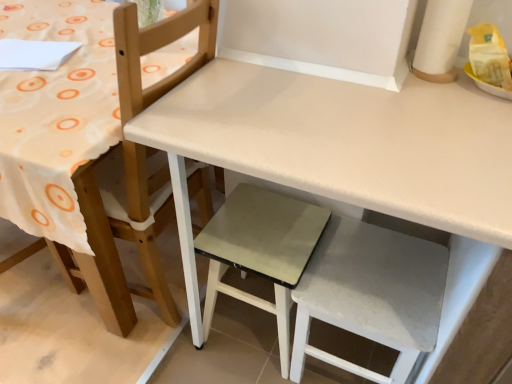
Question: Is matte gray step stool at center, acting as the second step stool starting from the right, with white matte table at center?

Choices:
 (A) no
 (B) yes

Answer: (A)

Question: Can white matte table at center be found inside matte gray step stool at center, acting as the second step stool starting from the right?

Choices:
 (A) yes
 (B) no

Answer: (B)

Question: Is matte gray step stool at center, acting as the second step stool starting from the right, looking in the opposite direction of white matte table at center?

Choices:
 (A) yes
 (B) no

Answer: (A)

Question: Is matte gray step stool at center, acting as the second step stool starting from the right, not close to white matte table at center?

Choices:
 (A) yes
 (B) no

Answer: (B)

Question: From the image's perspective, would you say matte gray step stool at center, acting as the second step stool starting from the right, is shown under white matte table at center?

Choices:
 (A) yes
 (B) no

Answer: (A)

Question: Does matte gray step stool at center, acting as the second step stool starting from the right, turn towards white matte table at center?

Choices:
 (A) no
 (B) yes

Answer: (B)

Question: Considering the relative positions of white fabric step stool at lower right, placed as the second step stool when sorted from left to right, and white matte table at center in the image provided, is white fabric step stool at lower right, placed as the second step stool when sorted from left to right, to the left of white matte table at center from the viewer's perspective?

Choices:
 (A) no
 (B) yes

Answer: (B)

Question: Is the position of white fabric step stool at lower right, placed as the second step stool when sorted from left to right, less distant than that of white matte table at center?

Choices:
 (A) no
 (B) yes

Answer: (A)

Question: From the image's perspective, is white fabric step stool at lower right, the 1th step stool from the right, beneath white matte table at center?

Choices:
 (A) yes
 (B) no

Answer: (A)

Question: Considering the relative positions of white fabric step stool at lower right, the 1th step stool from the right, and white matte table at center in the image provided, is white fabric step stool at lower right, the 1th step stool from the right, to the right of white matte table at center from the viewer's perspective?

Choices:
 (A) no
 (B) yes

Answer: (A)

Question: Is white matte table at center completely or partially inside white fabric step stool at lower right, the 1th step stool from the right?

Choices:
 (A) no
 (B) yes

Answer: (A)

Question: Does white fabric step stool at lower right, the 1th step stool from the right, lie behind white matte table at center?

Choices:
 (A) yes
 (B) no

Answer: (A)

Question: From the image's perspective, is white matte chair at upper left on top of white matte table at center?

Choices:
 (A) yes
 (B) no

Answer: (A)